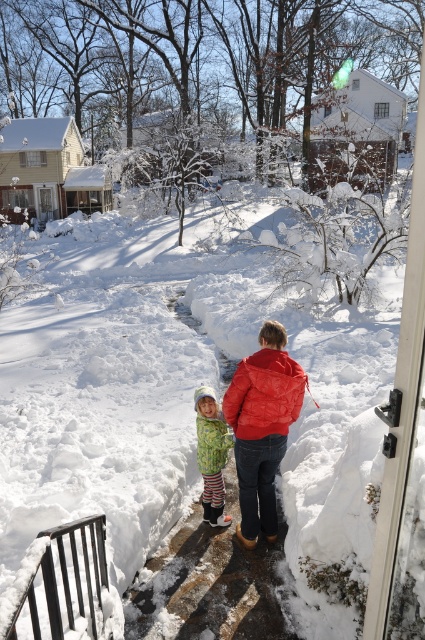
Does red quilted jacket at center lie behind matte red puffer jacket at center?

That is True.

Who is more distant from viewer, (266, 538) or (226, 408)?

The point (266, 538) is more distant.

This screenshot has height=640, width=425. In order to click on red quilted jacket at center in this screenshot , I will do `click(261, 426)`.

Can you confirm if smooth concrete path at center is thinner than matte red puffer jacket at center?

Incorrect, smooth concrete path at center's width is not less than matte red puffer jacket at center's.

Describe the element at coordinates (206, 588) in the screenshot. The width and height of the screenshot is (425, 640). I see `smooth concrete path at center` at that location.

Where is `smooth concrete path at center`? This screenshot has width=425, height=640. smooth concrete path at center is located at coordinates (206, 588).

Does matte red puffer jacket at center appear on the right side of green textured jacket at lower center?

→ Correct, you'll find matte red puffer jacket at center to the right of green textured jacket at lower center.

Describe the element at coordinates (263, 394) in the screenshot. I see `matte red puffer jacket at center` at that location.

Is point (305, 376) in front of point (206, 440)?

That is True.

The image size is (425, 640). What are the coordinates of `matte red puffer jacket at center` in the screenshot? It's located at (263, 394).